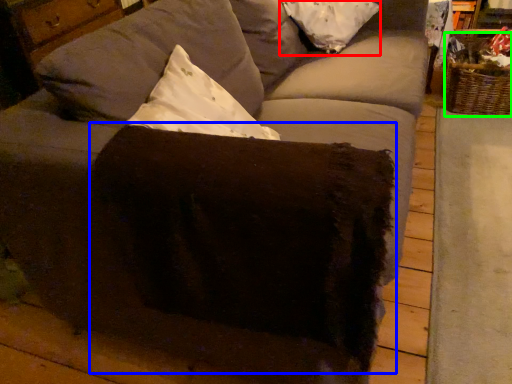
Question: Which object is positioned farthest from pillow (highlighted by a red box)? Select from swivel chair (highlighted by a blue box) and basket (highlighted by a green box).

Choices:
 (A) swivel chair
 (B) basket

Answer: (A)